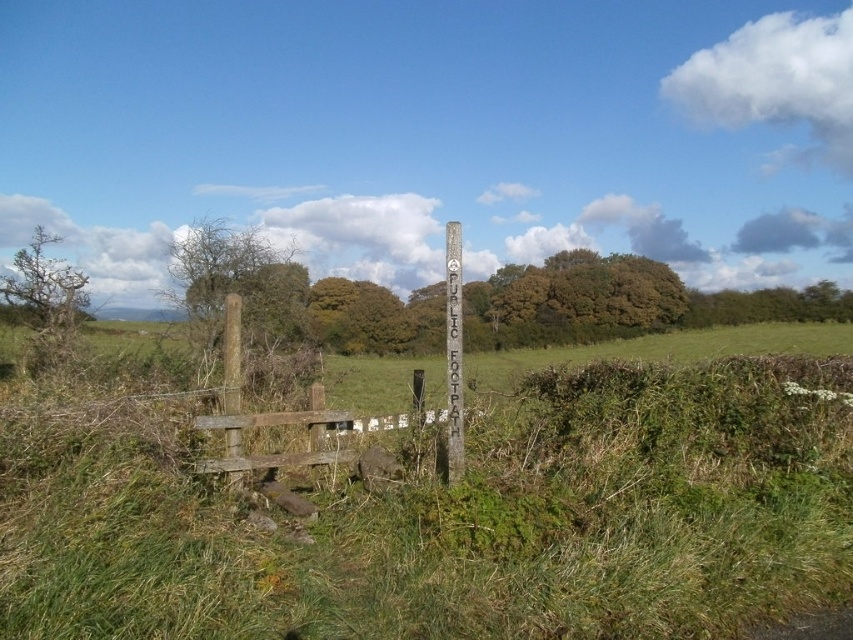
Question: Based on their relative distances, which object is farther from the brown wooden post at left?

Choices:
 (A) brown wooden fence at lower left
 (B) green grassy at center
 (C) wooden post at center

Answer: (B)

Question: Estimate the real-world distances between objects in this image. Which object is closer to the brown wooden post at left?

Choices:
 (A) green grassy at center
 (B) wooden post at center
 (C) brown wooden fence at lower left

Answer: (C)

Question: Which object appears closest to the camera in this image?

Choices:
 (A) wooden post at center
 (B) brown wooden fence at lower left
 (C) green grassy at center
 (D) brown wooden post at left

Answer: (C)

Question: Is green grassy at center further to the viewer compared to brown wooden fence at lower left?

Choices:
 (A) no
 (B) yes

Answer: (A)

Question: Is green grassy at center smaller than brown wooden fence at lower left?

Choices:
 (A) yes
 (B) no

Answer: (B)

Question: Observing the image, what is the correct spatial positioning of brown wooden fence at lower left in reference to wooden post at center?

Choices:
 (A) below
 (B) above

Answer: (A)